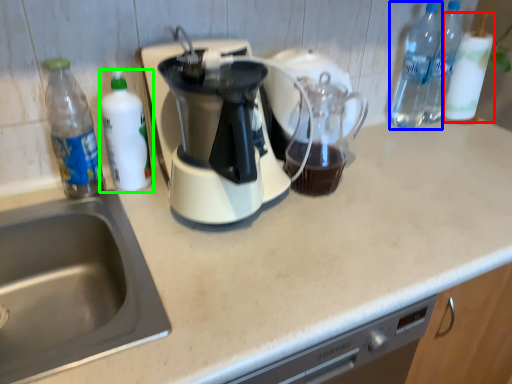
Question: Which object is positioned farthest from bottle (highlighted by a red box)? Select from bottle (highlighted by a blue box) and bottle (highlighted by a green box).

Choices:
 (A) bottle
 (B) bottle

Answer: (B)